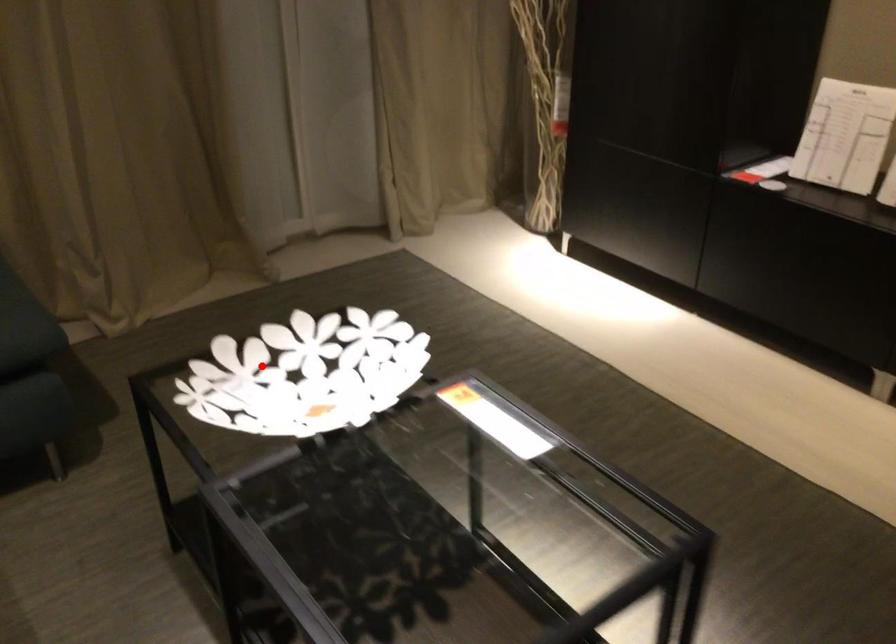
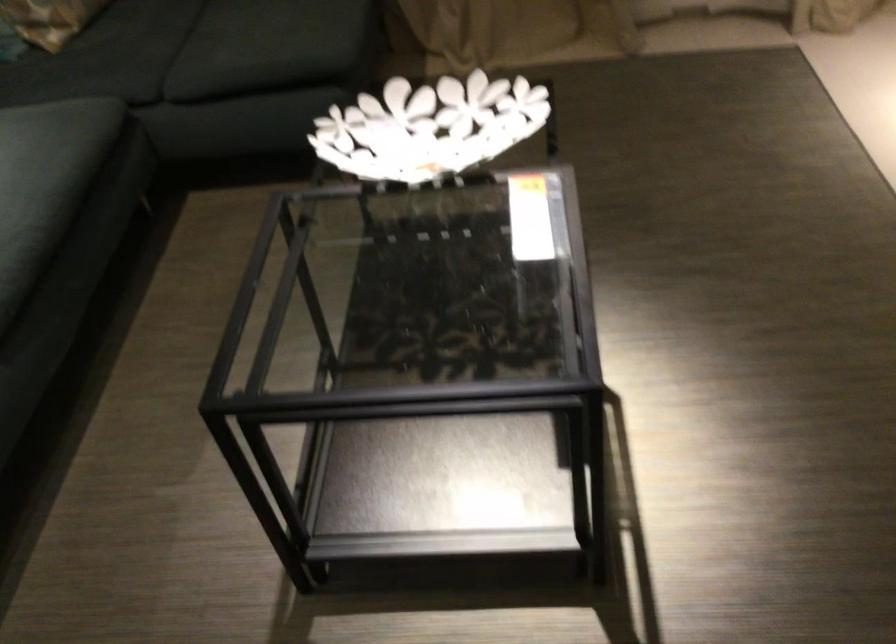
Locate, in the second image, the point that corresponds to the highlighted location in the first image.

(429, 127)